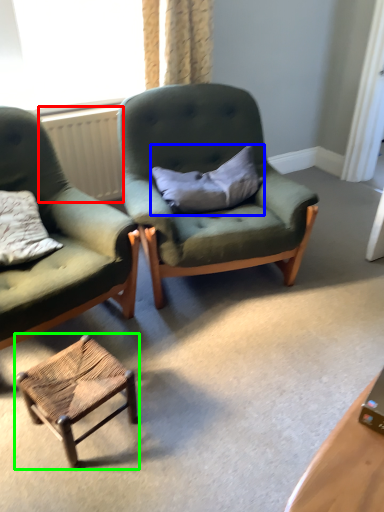
Question: Considering the real-world distances, which object is closest to radiator (highlighted by a red box)? pillow (highlighted by a blue box) or stool (highlighted by a green box).

Choices:
 (A) pillow
 (B) stool

Answer: (A)